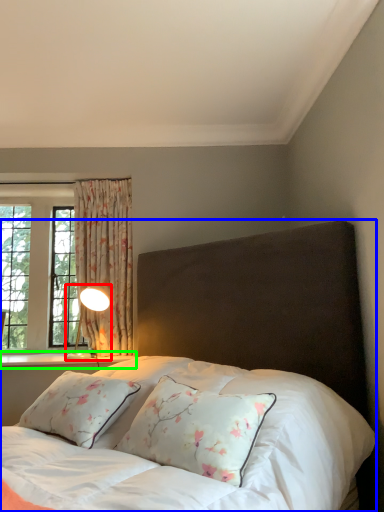
Question: Based on their relative distances, which object is nearer to table lamp (highlighted by a red box)? Choose from bed (highlighted by a blue box) and window sill (highlighted by a green box).

Choices:
 (A) bed
 (B) window sill

Answer: (B)